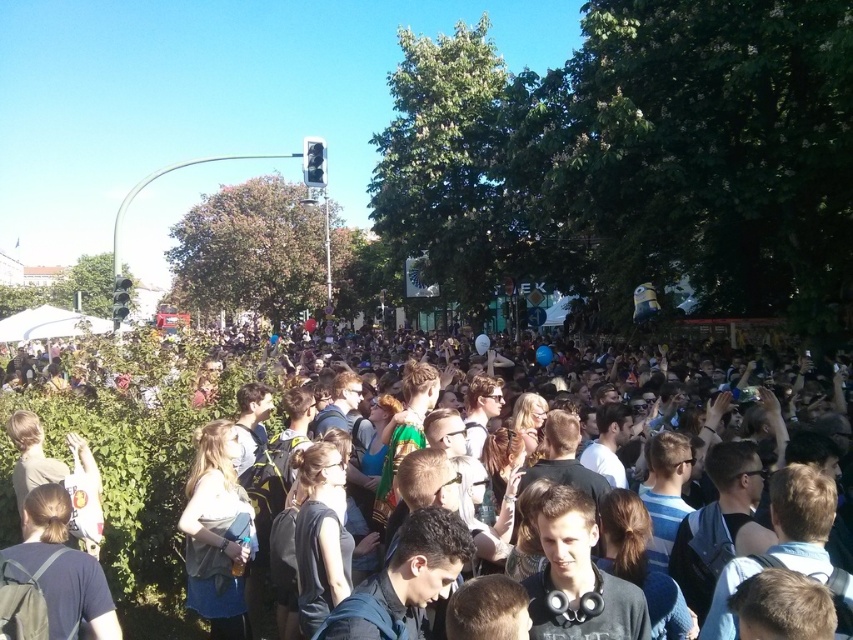
You are standing at the center of the crowd and notice someone wearing dark blue clothing at center. Can you determine their exact location using coordinates?

The dark blue clothing at center is located at coordinates point (134, 442).

You are trying to spot two people in the crowd. One is wearing dark blue clothing at center and the other is wearing a denim jacket at center. Which person is easier to notice because of their clothing size?

The dark blue clothing at center is bigger than the denim jacket at center, so the person wearing dark blue clothing at center is easier to notice due to their larger clothing size.